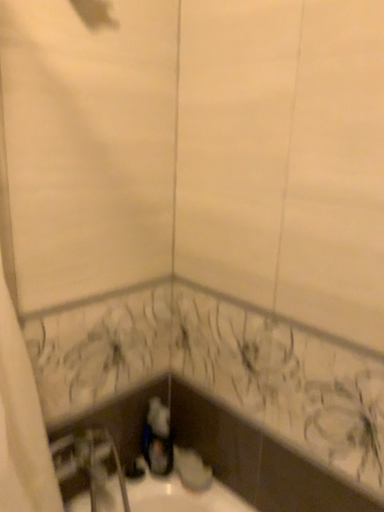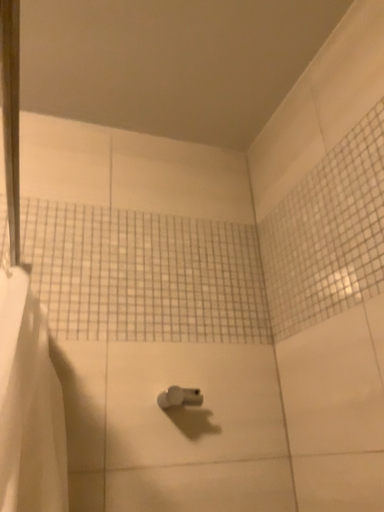
Question: How did the camera likely rotate when shooting the video?

Choices:
 (A) rotated upward
 (B) rotated downward

Answer: (A)